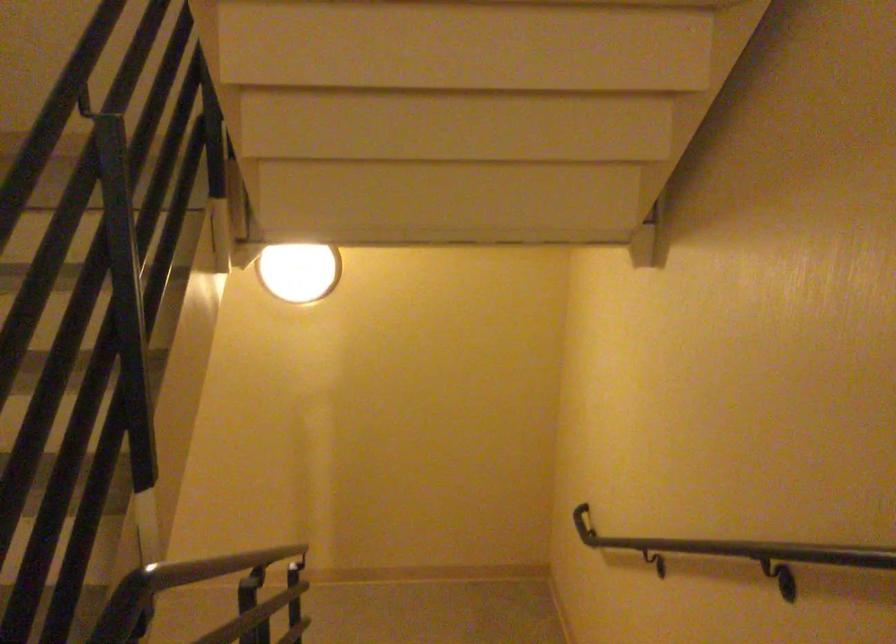
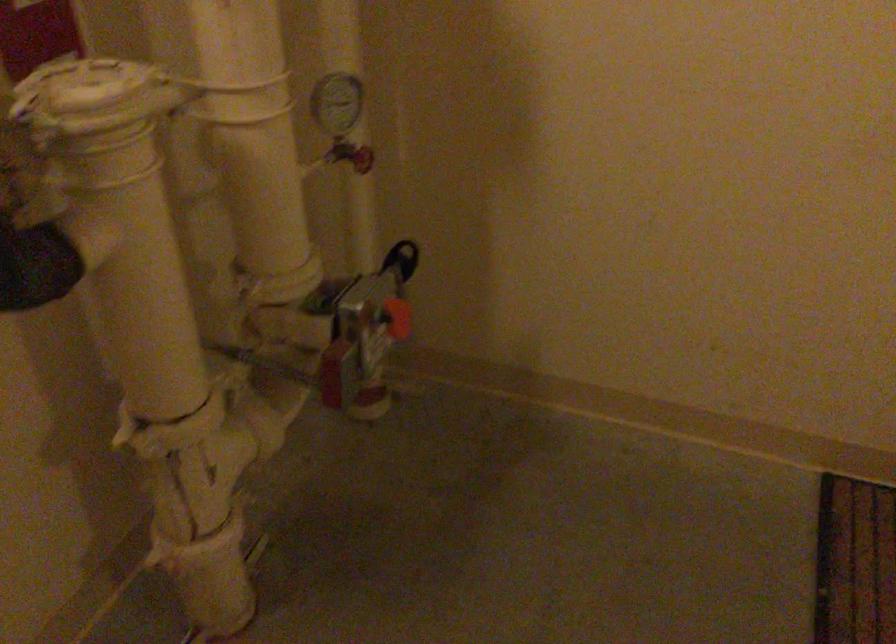
First-person continuous shooting, in which direction is the camera rotating?

The rotation direction of the camera is left-down.